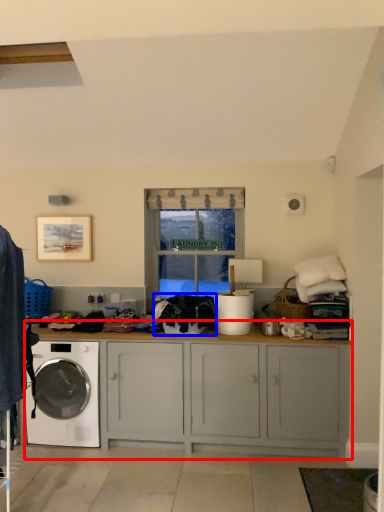
Question: Which object is further to the camera taking this photo, cabinetry (highlighted by a red box) or clothing (highlighted by a blue box)?

Choices:
 (A) cabinetry
 (B) clothing

Answer: (B)